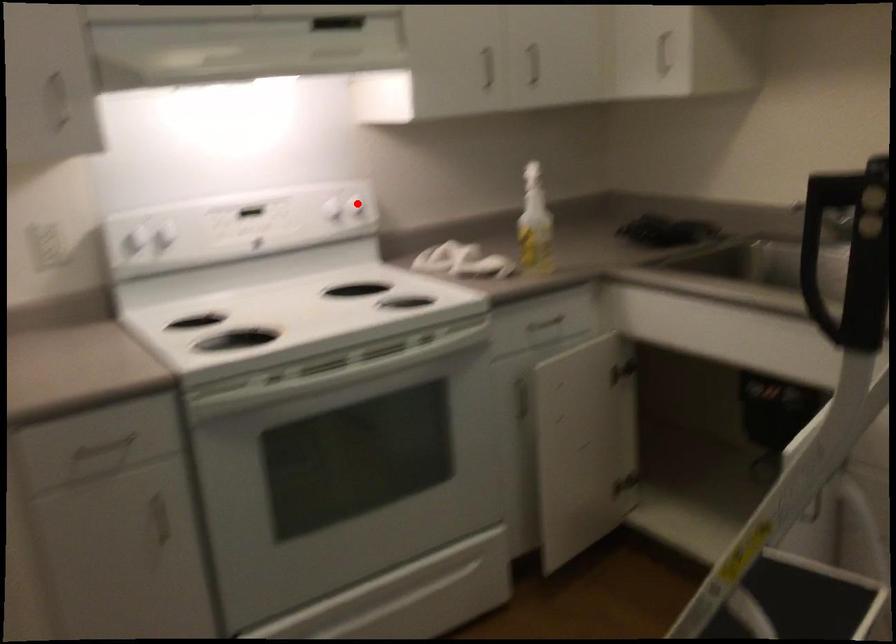
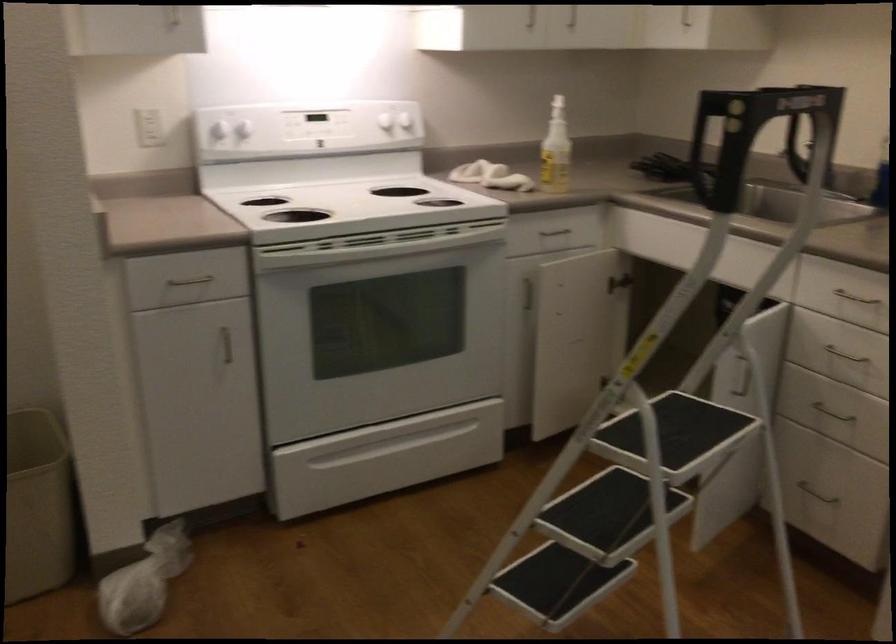
Question: I am providing you with two images of the same scene from different viewpoints. Image1 has a red point marked. In image2, the corresponding 3D location appears at what relative position? Reply with the corresponding letter.

Choices:
 (A) Closer
 (B) Farther

Answer: (B)